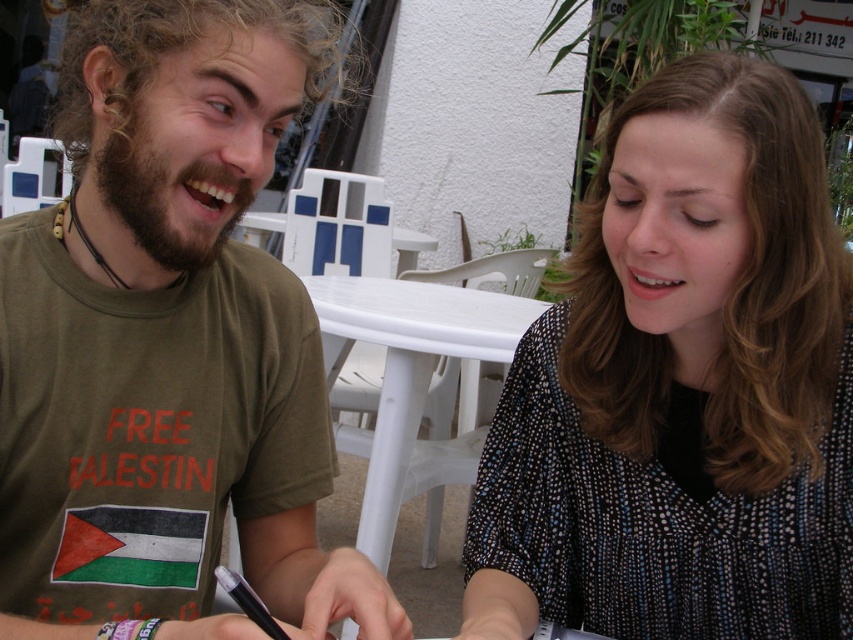
Please look at the coordinates provided in the image. Which object is located at point (682, 387)?

The point at (682, 387) marks the black dotted blouse at center.